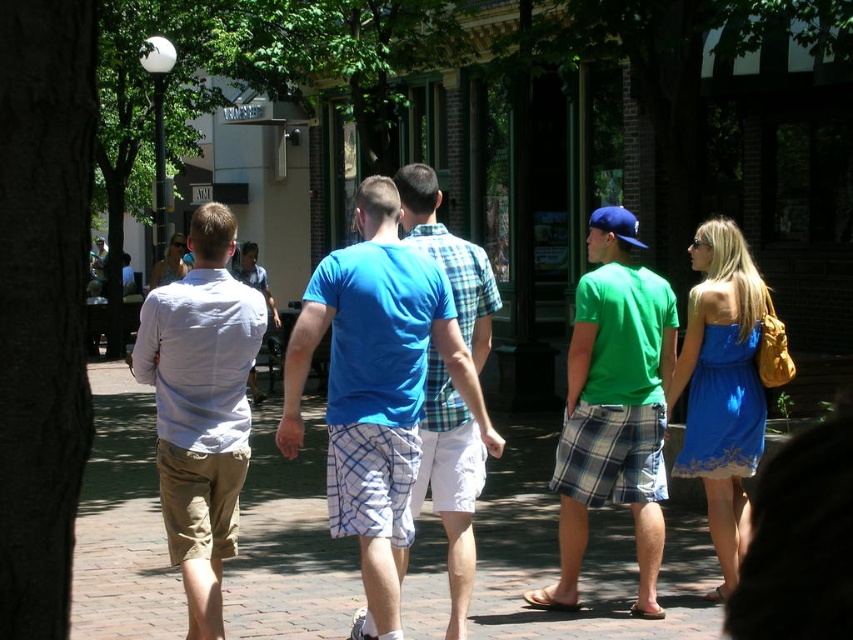
You are a photographer trying to capture a group photo of the white cotton shirt at left and the green plaid shorts at center. Since you want both subjects to appear equally sized in the photo, which subject should you move closer to the camera?

You should move closer to the white cotton shirt at left because its width is smaller than the green plaid shorts at center, making it appear smaller. By moving closer to it, you can balance their sizes in the photo.

Looking at this image, you are standing at point (637,282) and want to walk to point (390,339). Which direction should you move in relation to the street scene?

You should move forward towards point (390,339) because it is in front of your current position at point (637,282).